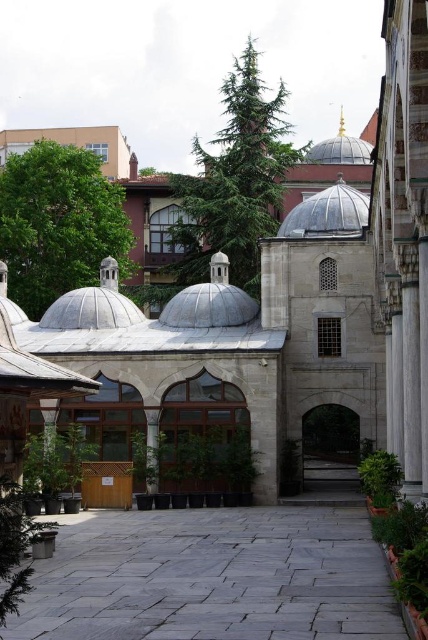
You are standing in the courtyard and want to take a photo of the metallic silver dome at center. Since the gray stone courtyard at center is in your line of sight, where should you position yourself to avoid the courtyard blocking the dome?

The gray stone courtyard at center is located below the metallic silver dome at center, so you should position yourself behind the gray stone courtyard at center to ensure the dome is visible above it without obstruction.

Looking at this image, you are an architect examining the courtyard of a historical building. You notice two domes in the center area. Which one is positioned lower in height between the metallic silver dome at center and the gold domed roof at center?

The metallic silver dome at center is positioned below the gold domed roof at center, so it is lower in height.